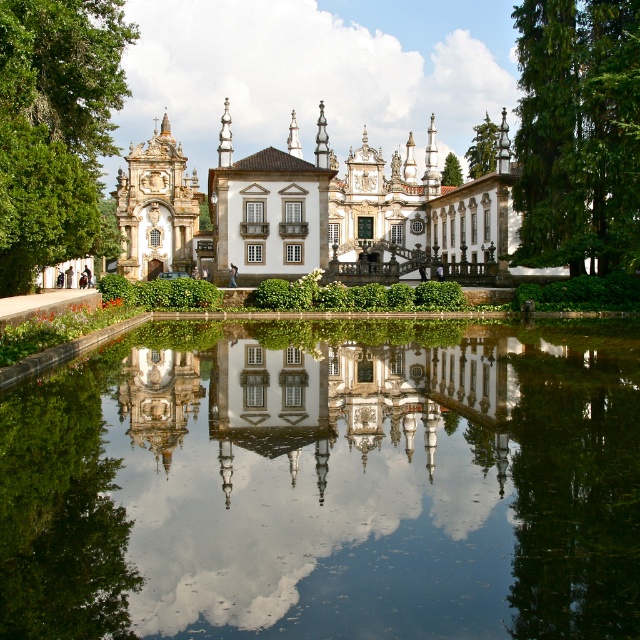
Question: Can you confirm if white stone palace at center is thinner than green leafy tree at left?

Choices:
 (A) no
 (B) yes

Answer: (A)

Question: Considering the real-world distances, which object is closest to the green leafy tree at left?

Choices:
 (A) green leafy tree at upper right
 (B) clear glass water at center
 (C) green leafy tree at upper center
 (D) white stone palace at center

Answer: (D)

Question: Does clear glass water at center appear under white stone palace at center?

Choices:
 (A) no
 (B) yes

Answer: (B)

Question: Which object is positioned farthest from the green leafy tree at upper center?

Choices:
 (A) green leafy tree at upper right
 (B) clear glass water at center
 (C) green leafy tree at center

Answer: (B)

Question: Considering the real-world distances, which object is farthest from the green leafy tree at center?

Choices:
 (A) white stone palace at center
 (B) green leafy tree at upper center
 (C) clear glass water at center
 (D) green leafy tree at left

Answer: (D)

Question: Does white stone palace at center have a greater width compared to green leafy tree at left?

Choices:
 (A) yes
 (B) no

Answer: (A)